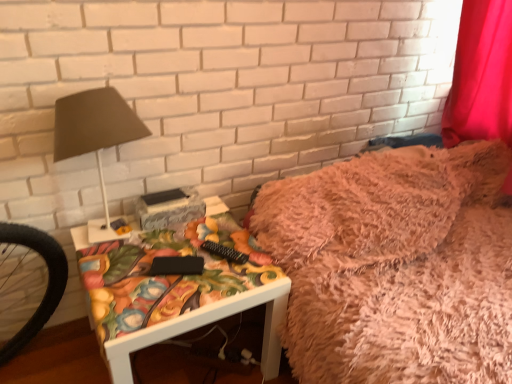
The width and height of the screenshot is (512, 384). I want to click on free space in front of matte brown lampshade at left, so click(126, 287).